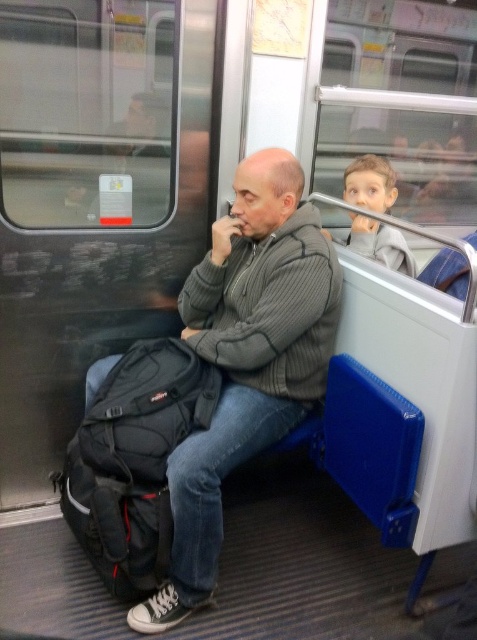
You are a fashion designer observing the subway car. You notice two gray items of clothing. The gray ribbed sweater at center and the smooth gray hoodie at upper right. Which one has a greater height?

The gray ribbed sweater at center is taller than the smooth gray hoodie at upper right.

You are standing in the subway car and need to find the gray ribbed sweater at center. Based on its coordinates, where should you look relative to the man seated on the blue bench?

The gray ribbed sweater at center is located at coordinates point (247, 358), which places it slightly to the right and above the man seated on the blue bench.